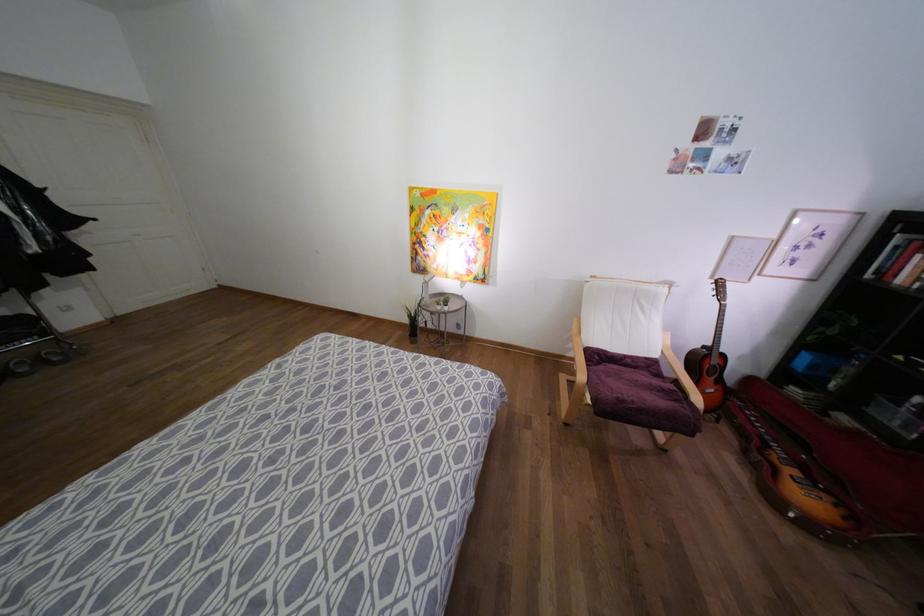
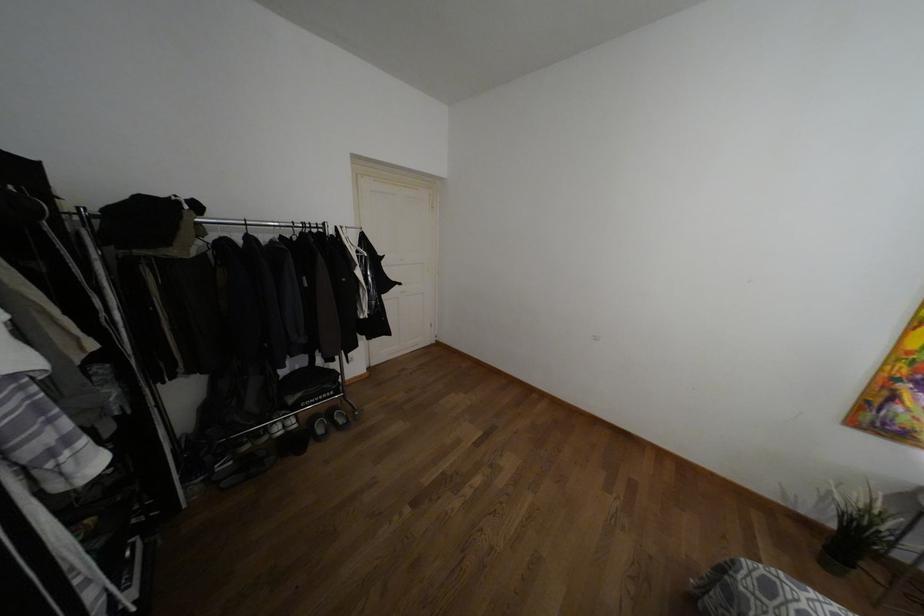
Locate, in the second image, the point that corresponds to (55,358) in the first image.

(341, 419)